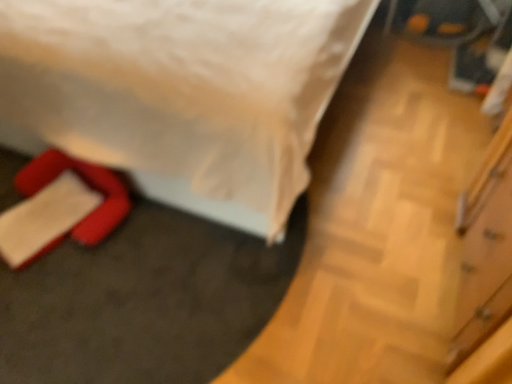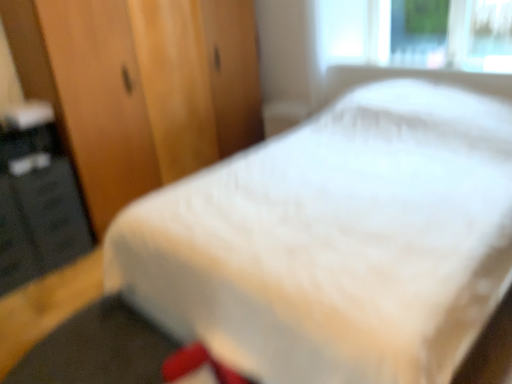
Question: How did the camera likely rotate when shooting the video?

Choices:
 (A) rotated right
 (B) rotated left

Answer: (B)